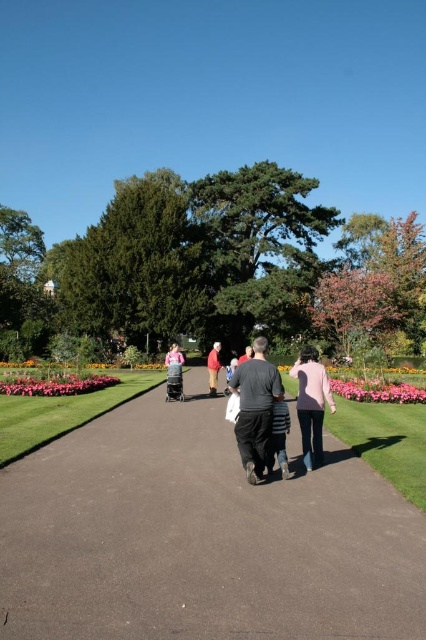
You are a photographer trying to capture both the dark gray fabric jacket at center and the dark gray sweater at center in a single shot. Given that your camera has a fixed focal length, which object should you focus on to ensure both are in frame without moving the camera?

You should focus on the dark gray sweater at center because it is wider than the dark gray fabric jacket at center, ensuring both will fit within the camera frame.